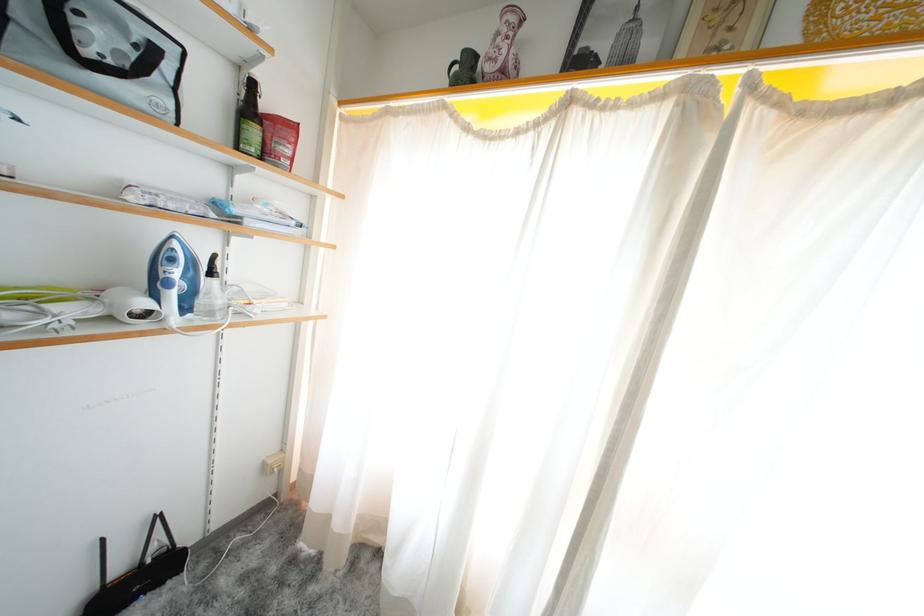
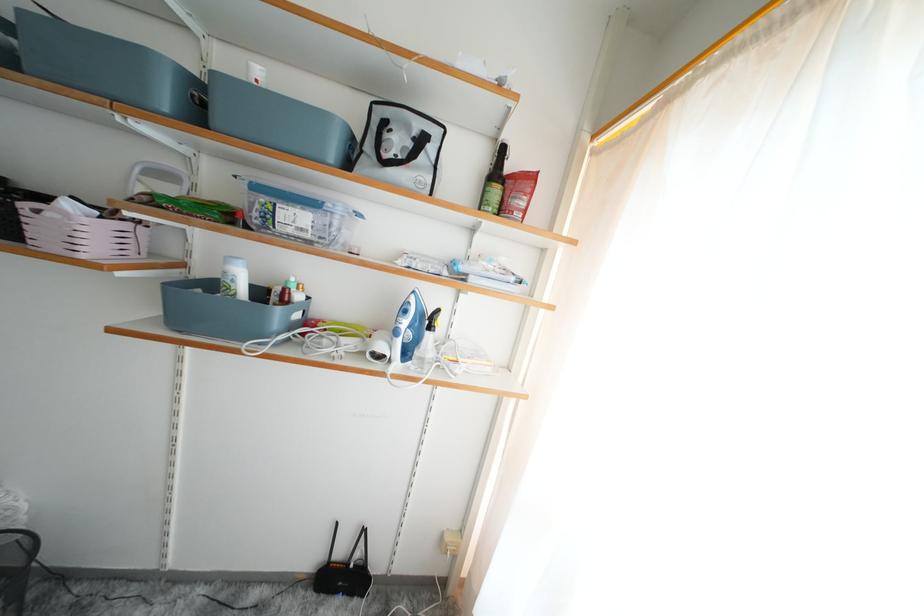
Question: How did the camera likely rotate?

Choices:
 (A) Left
 (B) Right
 (C) Up
 (D) Down

Answer: (A)